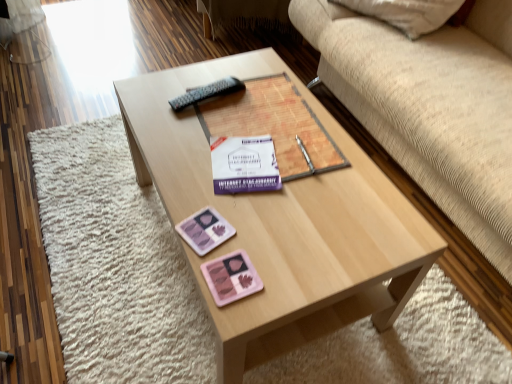
Where is `unoccupied space behind pink matte eyeshadow palette at lower center, which is the 1th currency from bottom to top`? The width and height of the screenshot is (512, 384). unoccupied space behind pink matte eyeshadow palette at lower center, which is the 1th currency from bottom to top is located at coordinates (247, 221).